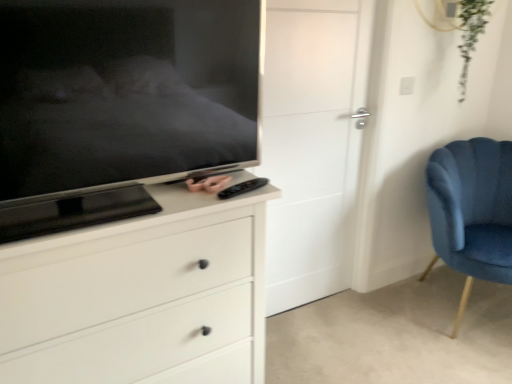
You are a GUI agent. You are given a task and a screenshot of the screen. Output one action in this format:
    pyautogui.click(x=<x>, y=<y>)
    Task: Click on the vacant space underneath matte black tv at left (from a real-world perspective)
    The width and height of the screenshot is (512, 384).
    Given the screenshot: What is the action you would take?
    pyautogui.click(x=128, y=204)